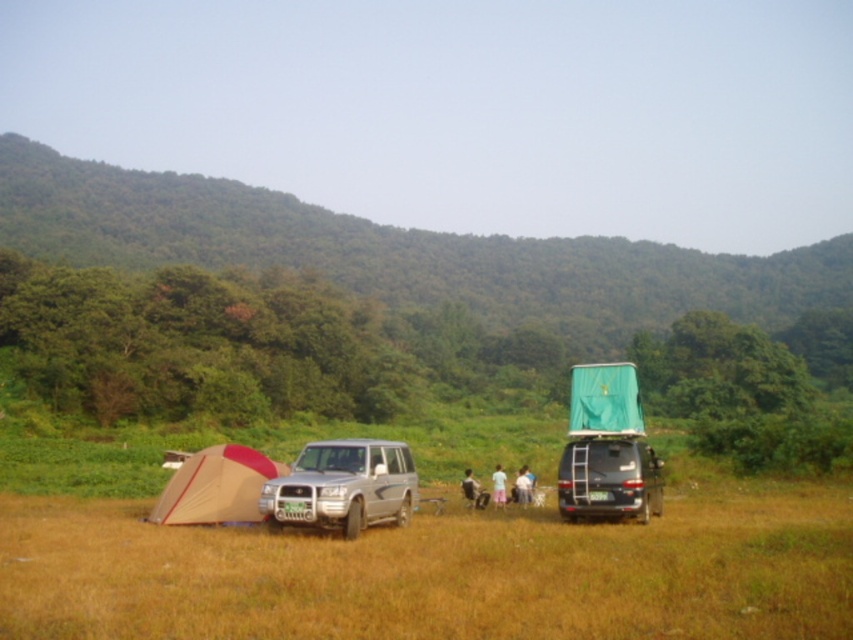
Question: Which of the following is the closest to the observer?

Choices:
 (A) brown fabric tent at lower left
 (B) pink fabric person at center

Answer: (A)

Question: Does brown fabric tent at lower left have a lesser width compared to pink fabric person at center?

Choices:
 (A) yes
 (B) no

Answer: (B)

Question: Considering the real-world distances, which object is closest to the silver metallic suv at center?

Choices:
 (A) metallic silver jeep at lower right
 (B) beige fabric tent at lower left
 (C) brown fabric tent at lower left

Answer: (B)

Question: Where is metallic silver jeep at lower right located in relation to white fabric person at center in the image?

Choices:
 (A) below
 (B) above

Answer: (B)

Question: Does beige fabric tent at lower left appear on the left side of silver metallic suv at center?

Choices:
 (A) no
 (B) yes

Answer: (B)

Question: Which of the following is the closest to the observer?

Choices:
 (A) (611, 448)
 (B) (494, 490)

Answer: (A)